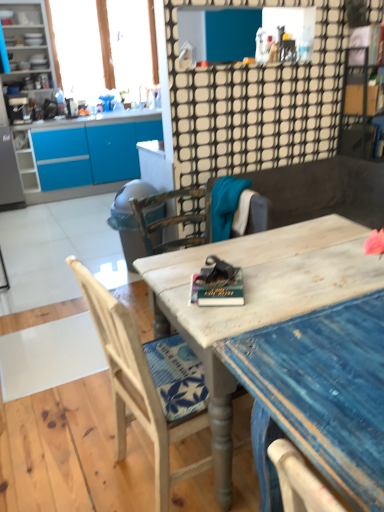
Question: Are wooden chair at center, acting as the 2th chair starting from the front, and wooden chair at center, marked as the 1th chair in a front-to-back arrangement, making contact?

Choices:
 (A) yes
 (B) no

Answer: (B)

Question: From the image's perspective, is wooden chair at center, acting as the 2th chair starting from the front, below wooden chair at center, the 2th chair positioned from the back?

Choices:
 (A) no
 (B) yes

Answer: (A)

Question: From a real-world perspective, is wooden chair at center, acting as the 2th chair starting from the front, on wooden chair at center, marked as the 1th chair in a front-to-back arrangement?

Choices:
 (A) yes
 (B) no

Answer: (A)

Question: Can you confirm if wooden chair at center, acting as the 2th chair starting from the front, is bigger than wooden chair at center, the 2th chair positioned from the back?

Choices:
 (A) no
 (B) yes

Answer: (A)

Question: Is wooden chair at center, acting as the 2th chair starting from the front, to the left of wooden chair at center, the 2th chair positioned from the back, from the viewer's perspective?

Choices:
 (A) no
 (B) yes

Answer: (A)

Question: Is wooden chair at center, acting as the 2th chair starting from the front, facing away from wooden chair at center, marked as the 1th chair in a front-to-back arrangement?

Choices:
 (A) no
 (B) yes

Answer: (A)

Question: Is matte white cabinet at upper left a part of translucent fabric at upper left?

Choices:
 (A) yes
 (B) no

Answer: (B)

Question: Can you confirm if translucent fabric at upper left is wider than matte white cabinet at upper left?

Choices:
 (A) yes
 (B) no

Answer: (B)

Question: Considering the relative sizes of translucent fabric at upper left and matte white cabinet at upper left in the image provided, is translucent fabric at upper left bigger than matte white cabinet at upper left?

Choices:
 (A) no
 (B) yes

Answer: (A)

Question: Is translucent fabric at upper left in contact with matte white cabinet at upper left?

Choices:
 (A) no
 (B) yes

Answer: (A)

Question: Is translucent fabric at upper left in front of matte white cabinet at upper left?

Choices:
 (A) yes
 (B) no

Answer: (B)

Question: Is translucent fabric at upper left completely or partially outside of matte white cabinet at upper left?

Choices:
 (A) yes
 (B) no

Answer: (A)

Question: Can you confirm if matte gray trash can at center-left is taller than matte white cabinet at upper left?

Choices:
 (A) no
 (B) yes

Answer: (A)